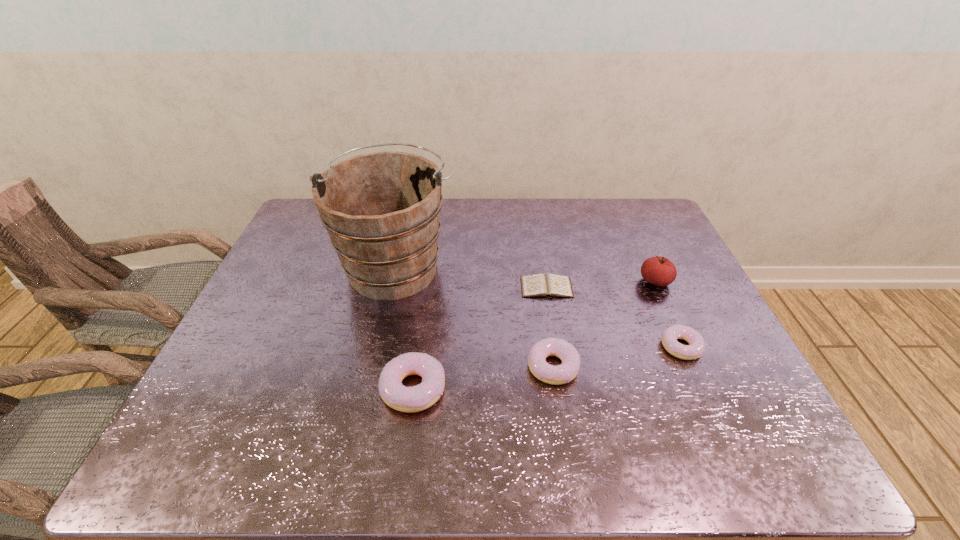
In the image, there is a desktop. Where is `vacant region at the near edge`? vacant region at the near edge is located at coordinates (636, 403).

Locate an element on the screen. vacant position at the left edge of the desktop is located at coordinates (262, 328).

In the image, there is a desktop. Identify the location of vacant space at the right edge. Image resolution: width=960 pixels, height=540 pixels. (697, 312).

Find the location of a particular element. The width and height of the screenshot is (960, 540). unoccupied position between the second doughnut from right to left and the shortest doughnut is located at coordinates (617, 356).

Where is `vacant space that's between the second doughnut from right to left and the fourth shortest object`? vacant space that's between the second doughnut from right to left and the fourth shortest object is located at coordinates (483, 377).

Where is `empty space that is in between the second tallest doughnut and the tallest doughnut`? This screenshot has width=960, height=540. empty space that is in between the second tallest doughnut and the tallest doughnut is located at coordinates (483, 377).

Where is `empty location between the tomato and the tallest doughnut`? empty location between the tomato and the tallest doughnut is located at coordinates (535, 335).

The image size is (960, 540). What are the coordinates of `vacant space that's between the leftmost doughnut and the fourth tallest object` in the screenshot? It's located at (483, 377).

I want to click on empty space between the tomato and the shortest object, so (601, 285).

The width and height of the screenshot is (960, 540). What are the coordinates of `free space between the rightmost doughnut and the fifth shortest object` in the screenshot? It's located at (668, 314).